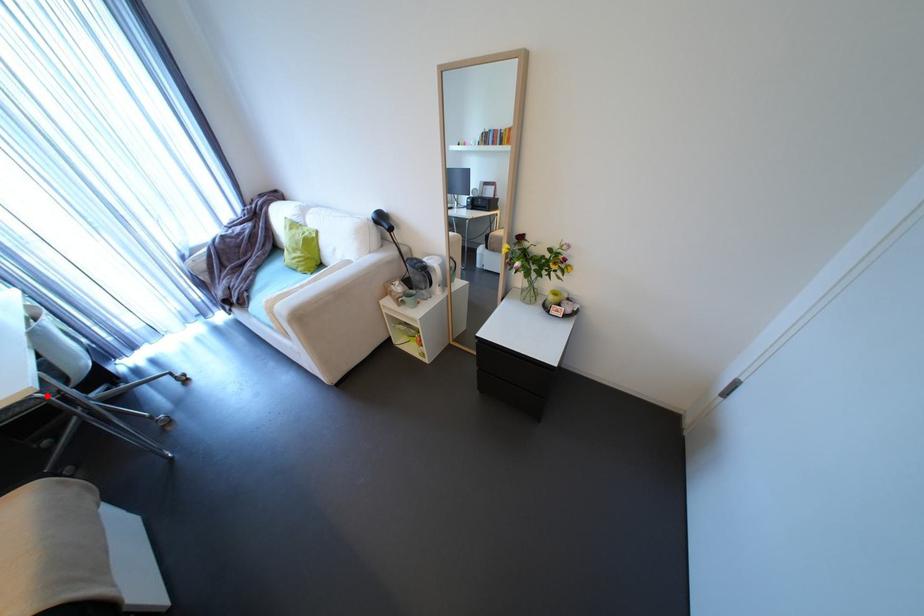
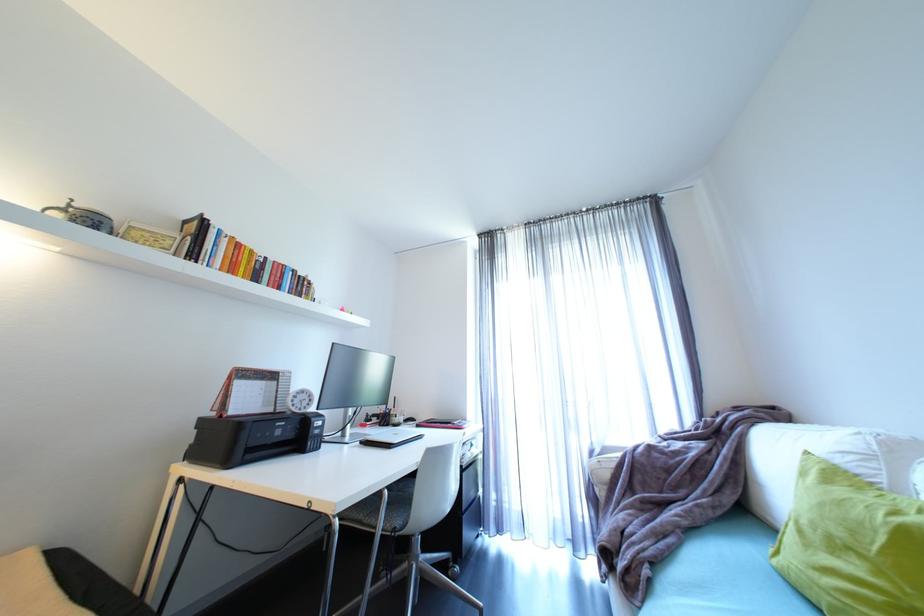
Question: I am providing you with two images of the same scene from different viewpoints. Given a red point in image1, look at the same physical point in image2. Is it:

Choices:
 (A) Closer to the viewpoint
 (B) Farther from the viewpoint

Answer: (A)